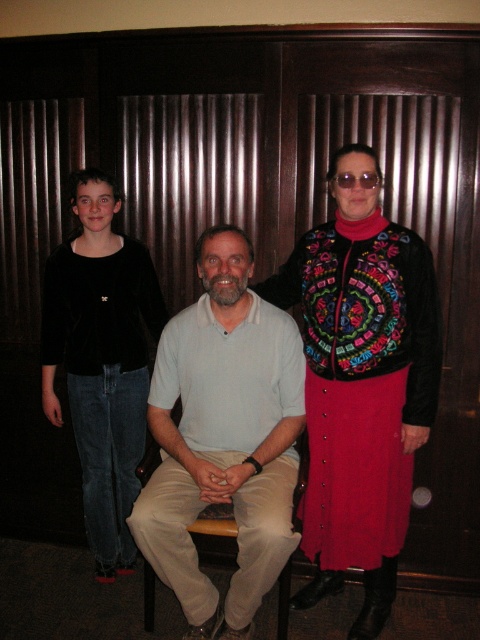
Question: Estimate the real-world distances between objects in this image. Which object is farther from the multicolored embroidered vest at center?

Choices:
 (A) transparent plastic goggles at upper center
 (B) black velvet shirt at left
 (C) light beige cotton shirt at center

Answer: (B)

Question: Is multicolored embroidered vest at center closer to camera compared to black velvet shirt at left?

Choices:
 (A) no
 (B) yes

Answer: (B)

Question: Is black velvet shirt at left wider than transparent plastic goggles at upper center?

Choices:
 (A) yes
 (B) no

Answer: (A)

Question: Which point appears farthest from the camera in this image?

Choices:
 (A) (82, 240)
 (B) (183, 561)
 (C) (363, 173)

Answer: (A)

Question: Where is multicolored embroidered vest at center located in relation to light beige cotton shirt at center in the image?

Choices:
 (A) right
 (B) left

Answer: (A)

Question: Which object appears closest to the camera in this image?

Choices:
 (A) light beige cotton shirt at center
 (B) multicolored embroidered vest at center
 (C) black velvet shirt at left

Answer: (A)